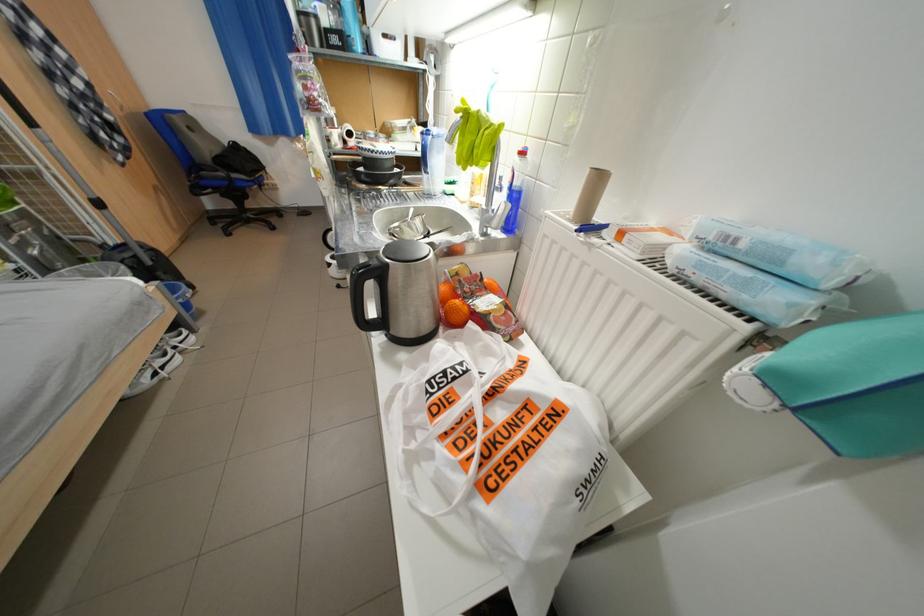
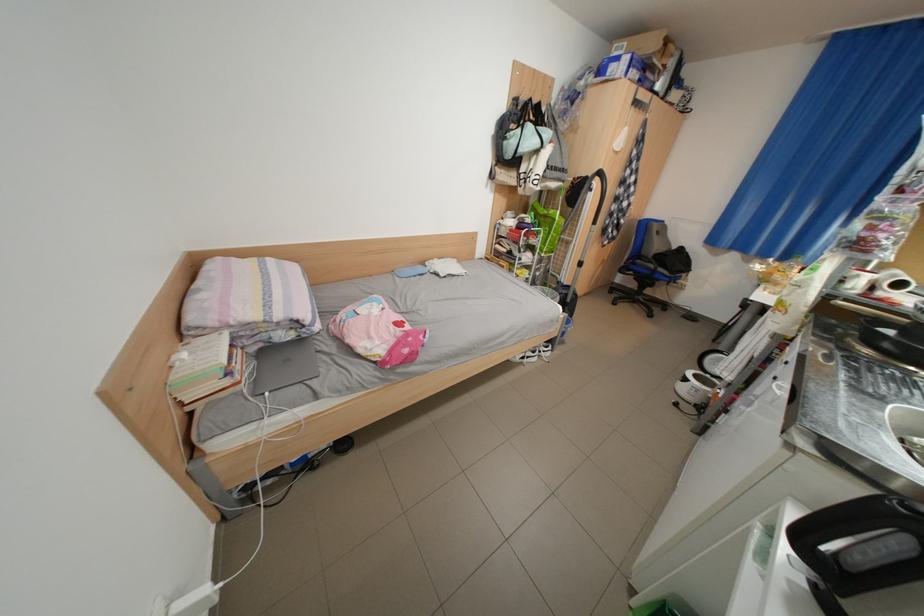
Question: The first image is from the beginning of the video and the second image is from the end. How did the camera likely rotate when shooting the video?

Choices:
 (A) Left
 (B) Right
 (C) Up
 (D) Down

Answer: (A)